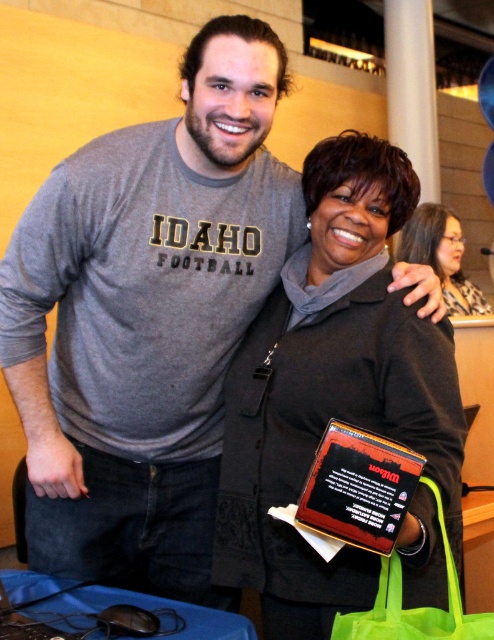
You are a photographer trying to capture a clear shot of both the matte black jacket at center and the black plastic plaque at center. Which object should you focus on first to ensure both are in focus?

The matte black jacket at center is closer to the viewer than the black plastic plaque at center. To ensure both are in focus, focus on the matte black jacket at center first, as it is closer, and the plaque will fall into focus behind it.

You are organizing a small event and need to place a name tag on the matte black jacket at center so it can be seen from a distance. The name tag you have is the same size as the black plastic plaque at center. Will the name tag be large enough to be visible from across the room?

The matte black jacket at center is larger in size than the black plastic plaque at center. Since the name tag is the same size as the plaque, it may not be large enough to be easily seen from a distance on the larger jacket.

You are at a party and need to find the leopard print scarf at upper right. Which direction should you look from the black plastic plaque at center?

The leopard print scarf at upper right is to the right of the black plastic plaque at center, so you should look to the right from the black plastic plaque at center to find it.